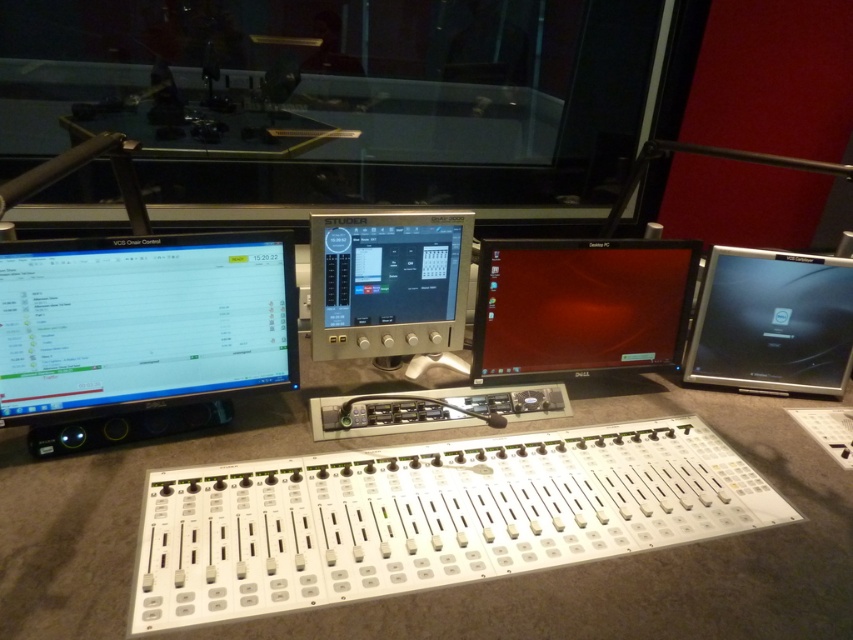
Question: Is matte black monitor at center to the right of silver metallic monitor at center from the viewer's perspective?

Choices:
 (A) no
 (B) yes

Answer: (B)

Question: Which object appears closest to the camera in this image?

Choices:
 (A) matte black monitor at left
 (B) silver metallic monitor at center
 (C) matte black monitor at center
 (D) matte silver laptop at right

Answer: (A)

Question: Considering the relative positions of matte black monitor at left and silver metallic monitor at center in the image provided, where is matte black monitor at left located with respect to silver metallic monitor at center?

Choices:
 (A) below
 (B) above

Answer: (A)

Question: From the image, what is the correct spatial relationship of silver metallic monitor at center in relation to matte silver laptop at right?

Choices:
 (A) left
 (B) right

Answer: (A)

Question: Which point is closer to the camera?

Choices:
 (A) matte black monitor at center
 (B) matte black monitor at left

Answer: (B)

Question: Which point is farther to the camera?

Choices:
 (A) silver metallic monitor at center
 (B) matte silver laptop at right
 (C) matte black monitor at left

Answer: (B)